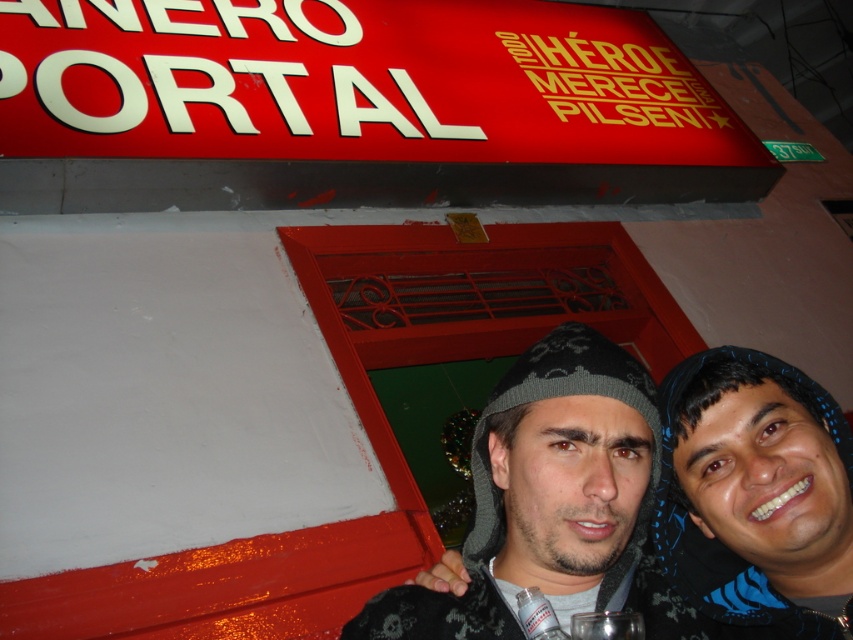
You are a photographer setting up a shot of the two people in front of the red storefront sign. You need to ensure that the blue knit cap at center and the clear glass wine glass at center are both visible in the frame. Given their sizes, which object will appear larger in the photo?

The blue knit cap at center is taller than the clear glass wine glass at center, so it will appear larger in the photo.

You are a photographer trying to capture the clear glass wine glass at center without the dark gray knit cap at center blocking it. How can you adjust your position to achieve this?

The dark gray knit cap at center is positioned over the clear glass wine glass at center. To capture the wine glass without obstruction, move your camera position lower so that the cap is no longer covering the glass.

You are a photographer trying to capture both the blue knit cap at center and the dark gray knit cap at center in a single shot. Based on their positions, which cap will appear closer to the camera in the photo?

The blue knit cap at center will appear closer to the camera because the dark gray knit cap at center is positioned behind it.